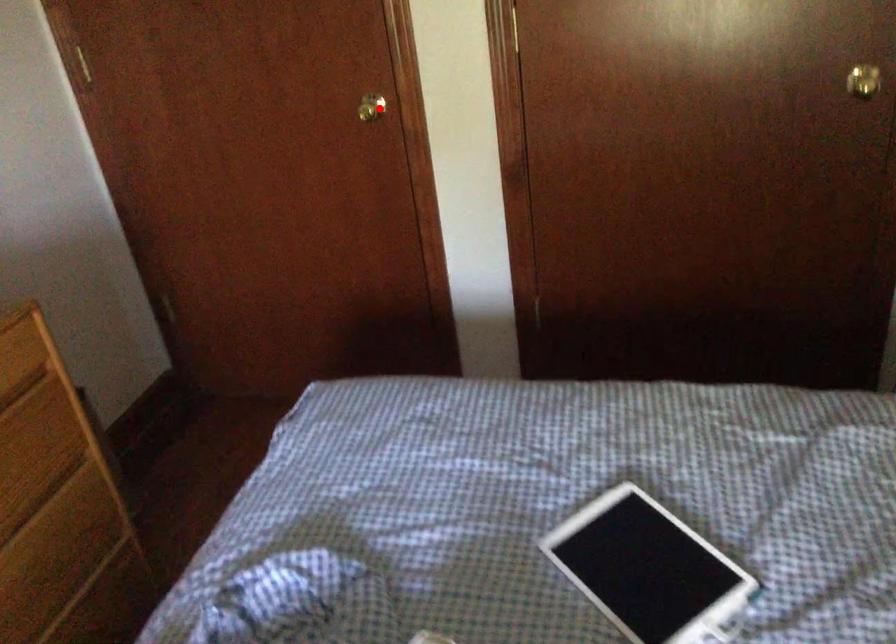
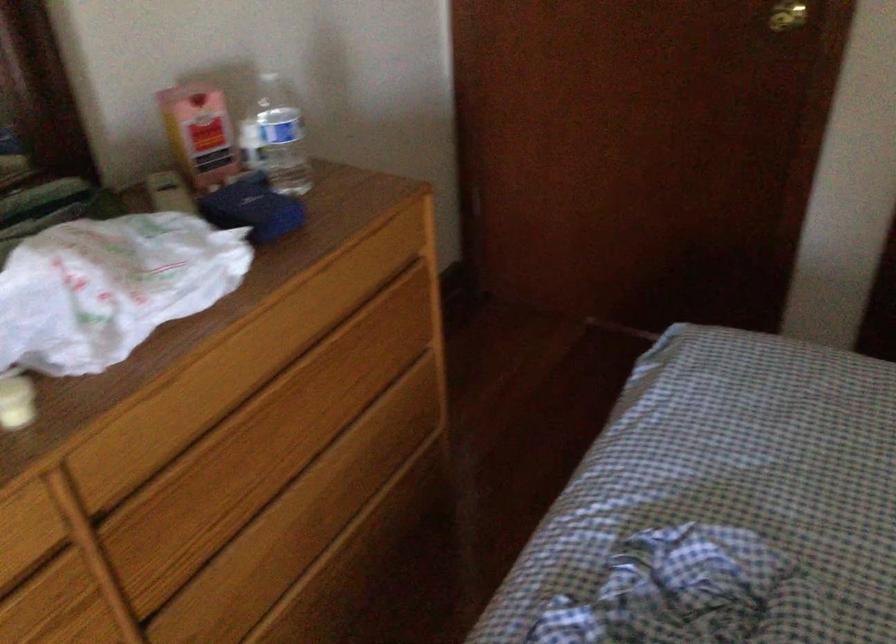
Where in the second image is the point corresponding to the highlighted location from the first image?

(787, 15)